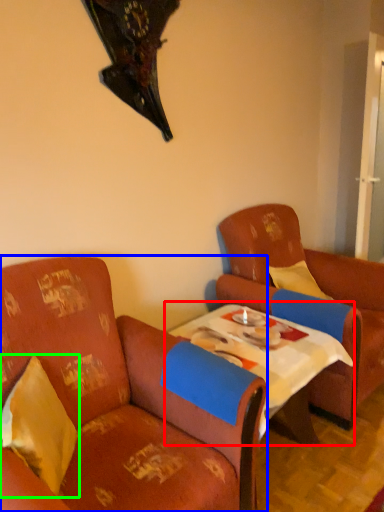
Question: Estimate the real-world distances between objects in this image. Which object is closer to table (highlighted by a red box), chair (highlighted by a blue box) or pillow (highlighted by a green box)?

Choices:
 (A) chair
 (B) pillow

Answer: (A)